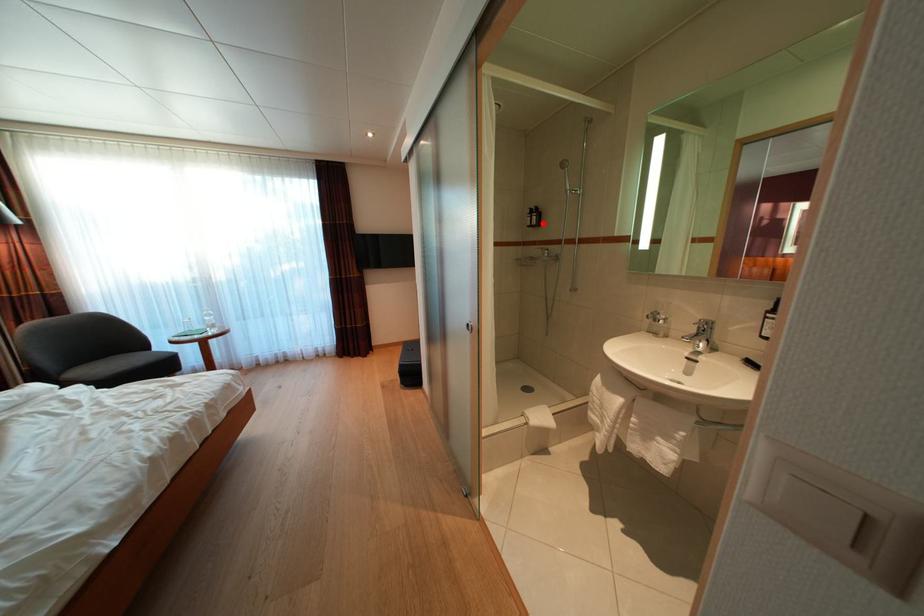
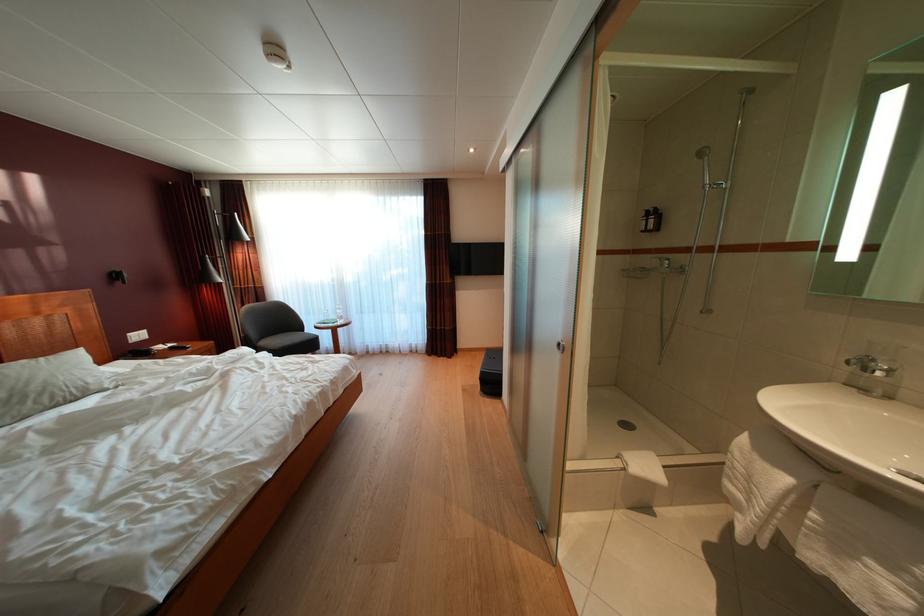
Where in the second image is the point corresponding to the highlighted location from the first image?

(660, 227)